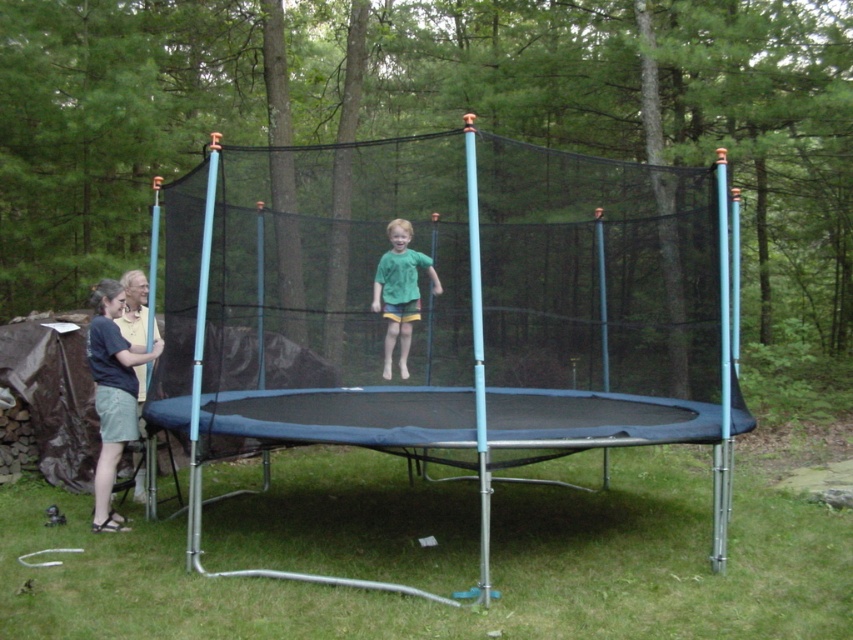
Question: Can you confirm if black mesh net at center is bigger than green matte shirt at center?

Choices:
 (A) yes
 (B) no

Answer: (A)

Question: Which of the following is the farthest from the observer?

Choices:
 (A) black mesh net at center
 (B) green matte shirt at center

Answer: (B)

Question: Can you confirm if black mesh net at center is thinner than green matte shirt at center?

Choices:
 (A) no
 (B) yes

Answer: (A)

Question: Does black mesh net at center have a greater width compared to green matte shirt at center?

Choices:
 (A) yes
 (B) no

Answer: (A)

Question: Which point is closer to the camera?

Choices:
 (A) black mesh net at center
 (B) green matte shirt at center

Answer: (A)